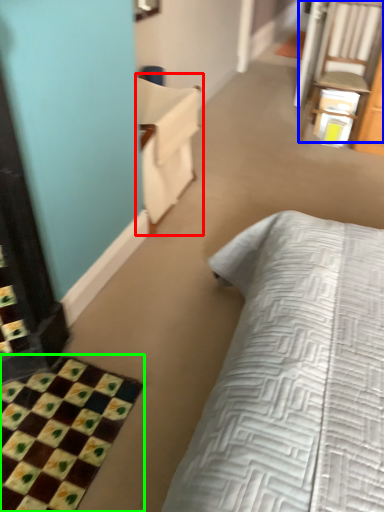
Question: Which object is positioned farthest from armchair (highlighted by a red box)? Select from chair (highlighted by a blue box) and bath mat (highlighted by a green box).

Choices:
 (A) chair
 (B) bath mat

Answer: (A)